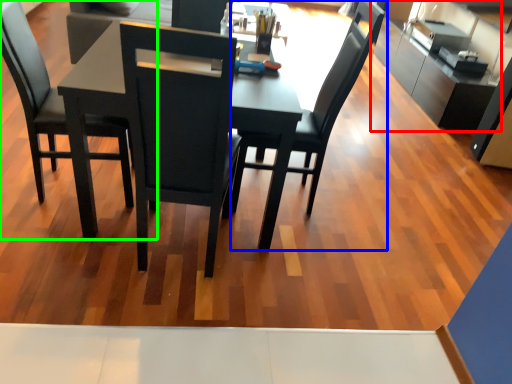
Question: Which object is the farthest from cabinetry (highlighted by a red box)? Choose among these: chair (highlighted by a blue box) or chair (highlighted by a green box).

Choices:
 (A) chair
 (B) chair

Answer: (B)